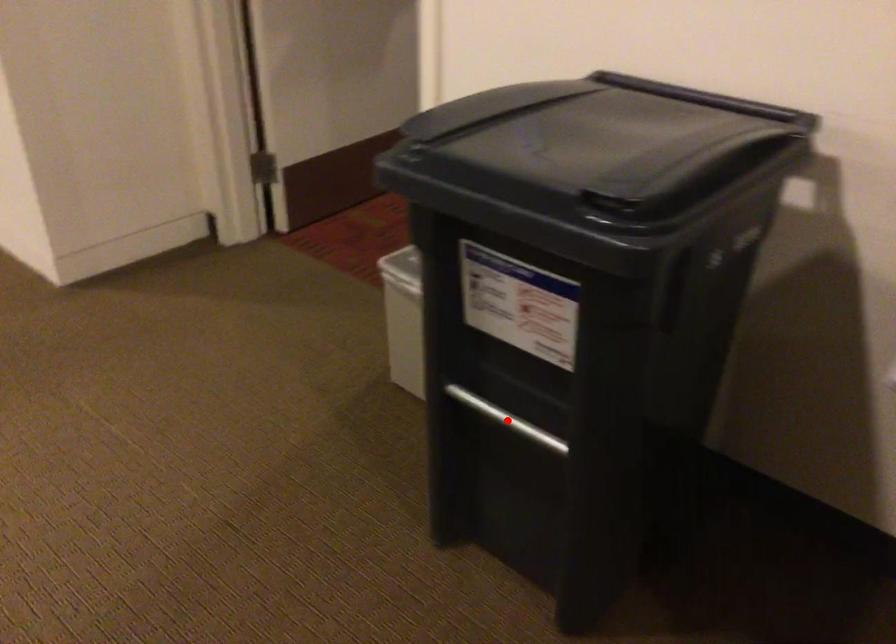
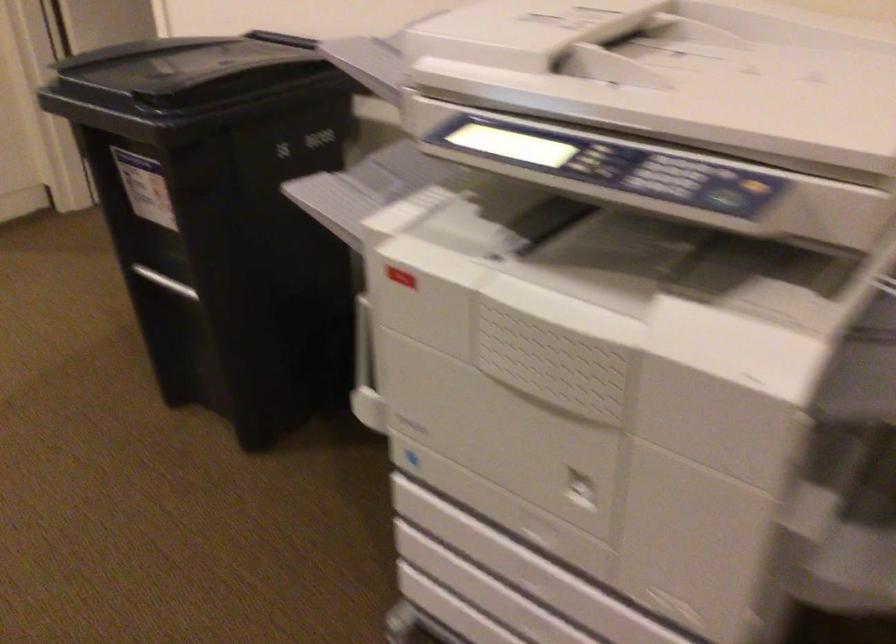
Question: I am providing you with two images of the same scene from different viewpoints. A red point is shown in image1. For the corresponding object point in image2, is it positioned nearer or farther from the camera?

Choices:
 (A) Nearer
 (B) Farther

Answer: (B)